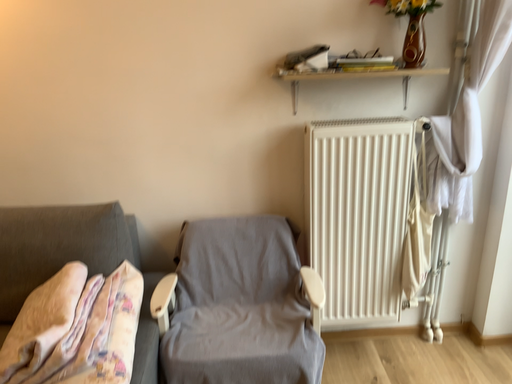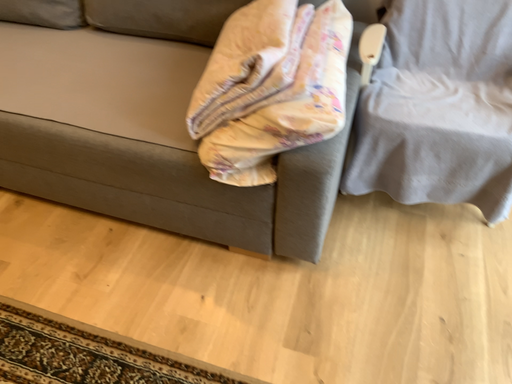
Question: Which way did the camera rotate in the video?

Choices:
 (A) rotated upward
 (B) rotated downward

Answer: (B)